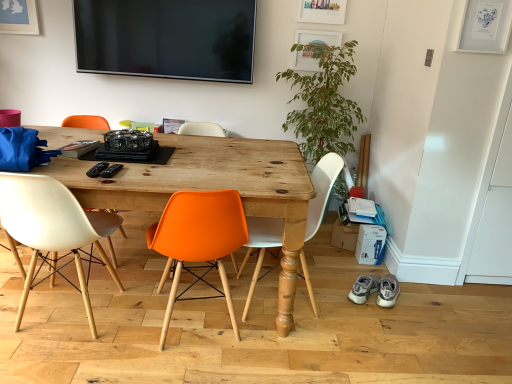
Question: In which direction should I rotate to look at orange plastic chair at center, which appears as the 2th chair when viewed from the left?

Choices:
 (A) right
 (B) left

Answer: (B)

Question: Is gray suede sneakers at lower right, the second footwear viewed from the right, looking in the opposite direction of wooden table at center?

Choices:
 (A) yes
 (B) no

Answer: (B)

Question: Is wooden table at center located within gray suede sneakers at lower right, the second footwear viewed from the right?

Choices:
 (A) no
 (B) yes

Answer: (A)

Question: Is the depth of gray suede sneakers at lower right, positioned as the first footwear in left-to-right order, less than that of wooden table at center?

Choices:
 (A) no
 (B) yes

Answer: (A)

Question: Can you confirm if gray suede sneakers at lower right, positioned as the first footwear in left-to-right order, is shorter than wooden table at center?

Choices:
 (A) yes
 (B) no

Answer: (A)

Question: From a real-world perspective, is gray suede sneakers at lower right, the second footwear viewed from the right, beneath wooden table at center?

Choices:
 (A) yes
 (B) no

Answer: (A)

Question: Is gray suede sneakers at lower right, positioned as the first footwear in left-to-right order, behind wooden table at center?

Choices:
 (A) yes
 (B) no

Answer: (A)

Question: Is gray suede sneakers at lower right, positioned as the first footwear in right-to-left order, touching white matte chair at center, acting as the 1th chair starting from the right?

Choices:
 (A) no
 (B) yes

Answer: (A)

Question: Could you tell me if gray suede sneakers at lower right, acting as the second footwear starting from the left, is turned towards white matte chair at center, the third chair viewed from the left?

Choices:
 (A) no
 (B) yes

Answer: (A)

Question: Considering the relative sizes of gray suede sneakers at lower right, positioned as the first footwear in right-to-left order, and white matte chair at center, acting as the 1th chair starting from the right, in the image provided, is gray suede sneakers at lower right, positioned as the first footwear in right-to-left order, taller than white matte chair at center, acting as the 1th chair starting from the right,?

Choices:
 (A) no
 (B) yes

Answer: (A)

Question: Is the position of gray suede sneakers at lower right, positioned as the first footwear in right-to-left order, less distant than that of white matte chair at center, acting as the 1th chair starting from the right?

Choices:
 (A) yes
 (B) no

Answer: (B)

Question: From the image's perspective, is gray suede sneakers at lower right, positioned as the first footwear in right-to-left order, under white matte chair at center, the third chair viewed from the left?

Choices:
 (A) no
 (B) yes

Answer: (B)

Question: Is gray suede sneakers at lower right, acting as the second footwear starting from the left, smaller than white matte chair at center, acting as the 1th chair starting from the right?

Choices:
 (A) yes
 (B) no

Answer: (A)

Question: From the image's perspective, would you say green leafy plant at right is shown under wooden table at center?

Choices:
 (A) yes
 (B) no

Answer: (B)